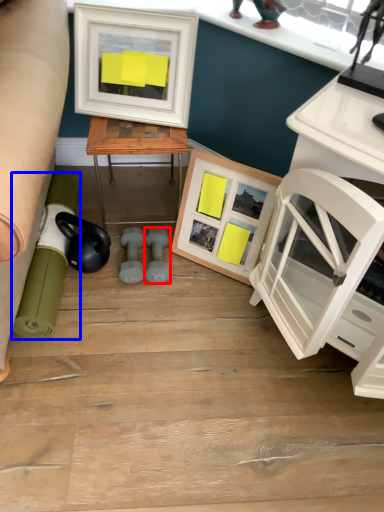
Question: Which point is closer to the camera, dumbbell (highlighted by a red box) or rolling pin (highlighted by a blue box)?

Choices:
 (A) dumbbell
 (B) rolling pin

Answer: (B)